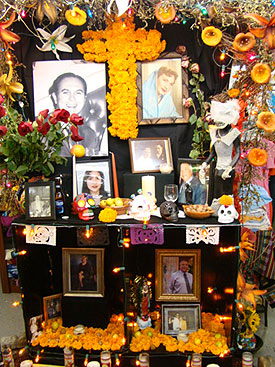
Identify the location of horizontal string of lights. (102, 227).